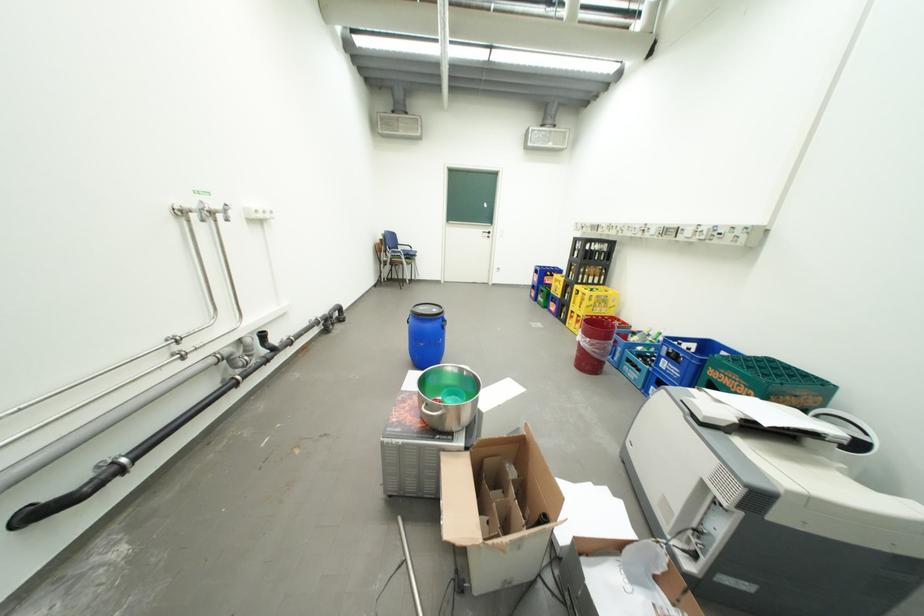
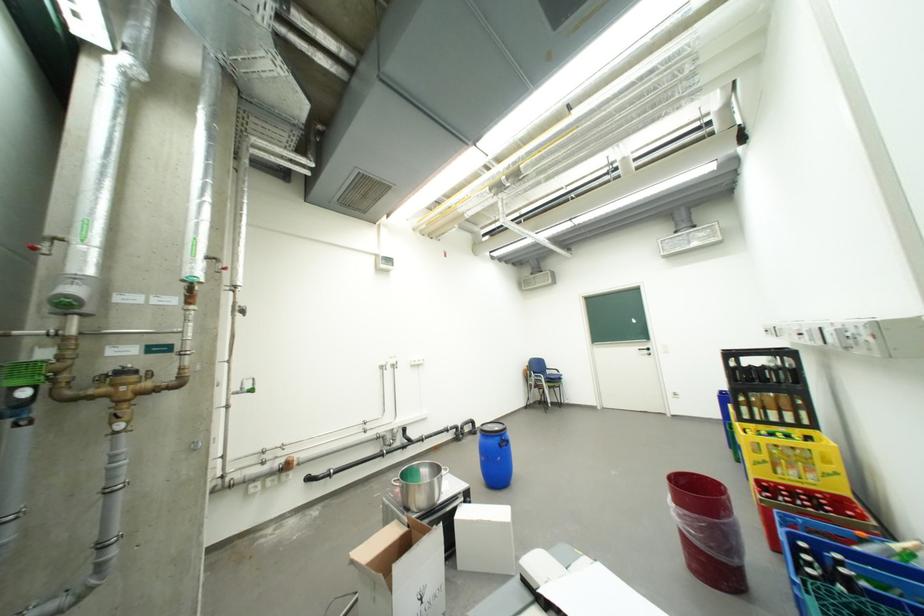
In the second image, find the point that corresponds to the point at 512,403 in the first image.

(484, 520)